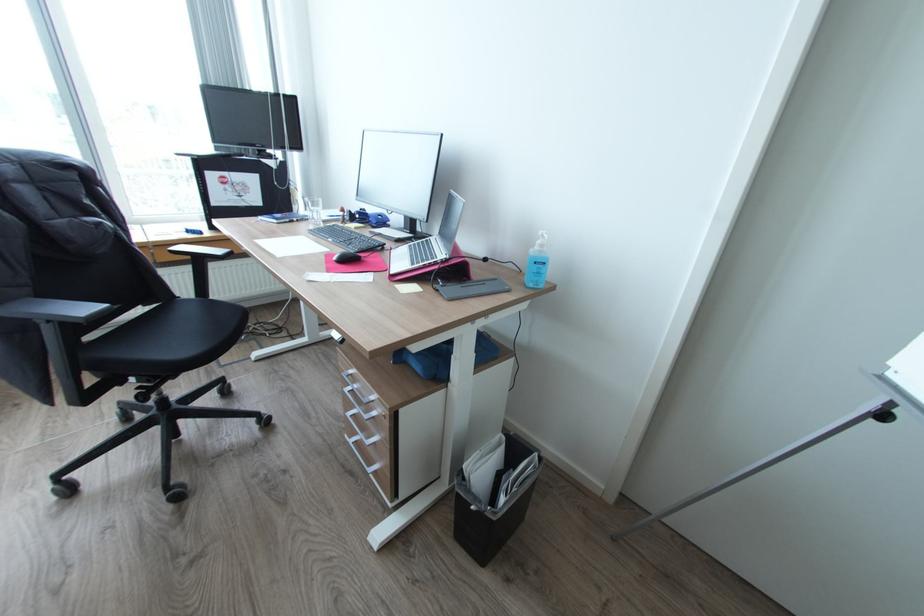
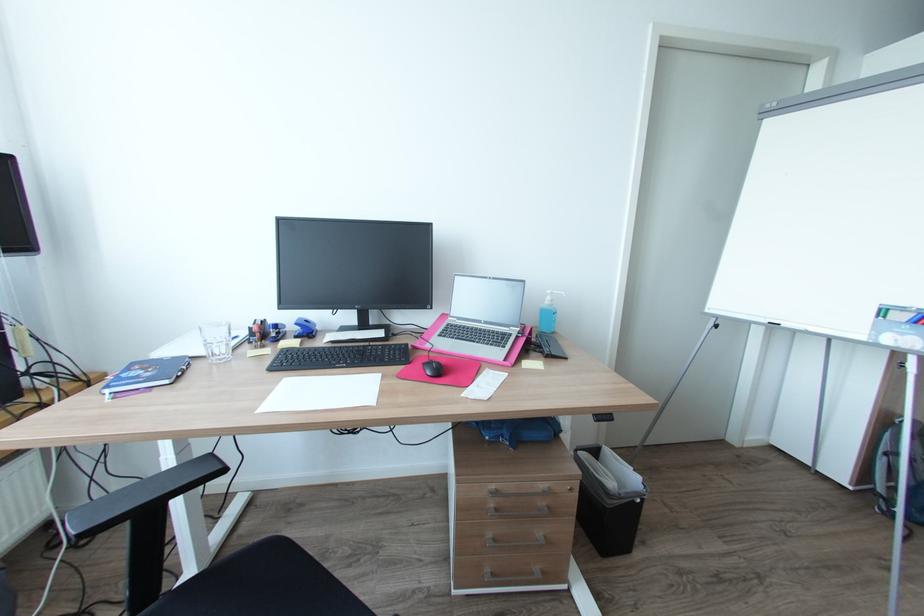
Find the pixel in the second image that matches (x=373, y=224) in the first image.

(301, 337)